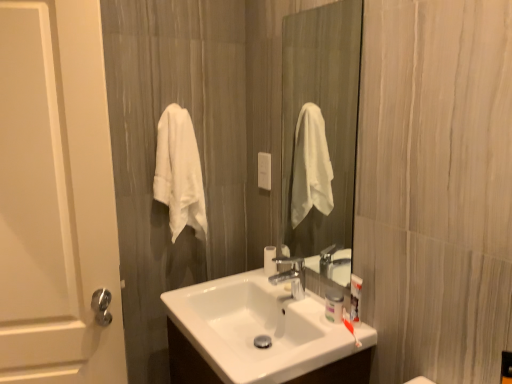
What do you see at coordinates (56, 197) in the screenshot? I see `white matte door at left` at bounding box center [56, 197].

Measure the distance between point (x=35, y=110) and camera.

Point (x=35, y=110) is 1.28 meters from camera.

You are a GUI agent. You are given a task and a screenshot of the screen. Output one action in this format:
    pyautogui.click(x=<x>, y=<y>)
    Task: Click on the white glossy sink at center
    
    Given the screenshot: What is the action you would take?
    pyautogui.click(x=259, y=335)

This screenshot has width=512, height=384. Identify the location of clear glass mirror at center. (320, 122).

Considering the relative sizes of clear glass mirror at center and white matte door at left in the image provided, is clear glass mirror at center taller than white matte door at left?

No.

Is clear glass mirror at center facing towards white matte door at left?

Yes, clear glass mirror at center faces towards white matte door at left.

Considering the relative positions of clear glass mirror at center and white matte door at left in the image provided, is clear glass mirror at center to the left or to the right of white matte door at left?

Based on their positions, clear glass mirror at center is located to the right of white matte door at left.

Is point (372, 330) closer or farther from the camera than point (98, 283)?

Point (372, 330) appears to be closer to the viewer than point (98, 283).

Locate an element on the screen. door located above the white glossy sink at center (from a real-world perspective) is located at coordinates (56, 197).

How many degrees apart are the facing directions of white glossy sink at center and white matte door at left?

The angular difference between white glossy sink at center and white matte door at left is 80.3 degrees.

From a real-world perspective, between white glossy sink at center and clear glass mirror at center, who is vertically higher?

clear glass mirror at center is physically above.

In the scene shown: Which is correct: white glossy sink at center is inside clear glass mirror at center, or outside of it?

The correct answer is: outside.

Does white glossy sink at center turn towards clear glass mirror at center?

No, white glossy sink at center is not turned towards clear glass mirror at center.

Locate an element on the screen. The height and width of the screenshot is (384, 512). mirror behind the white glossy sink at center is located at coordinates (320, 122).

Between white matte door at left and clear glass mirror at center, which one is positioned in front?

white matte door at left is in front.

From a real-world perspective, is white matte door at left physically located above or below clear glass mirror at center?

white matte door at left is below clear glass mirror at center.

Would you say white matte door at left contains clear glass mirror at center?

No.

From the image's perspective, would you say white matte door at left is positioned over clear glass mirror at center?

No.

Relative to white soft towel at left, is clear glass mirror at center in front or behind?

Clearly, clear glass mirror at center is in front of white soft towel at left.

Between point (355, 38) and point (193, 227), which one is positioned in front?

The point (193, 227) is in front.

Considering the relative positions of clear glass mirror at center and white soft towel at left in the image provided, is clear glass mirror at center to the right of white soft towel at left from the viewer's perspective?

Yes, clear glass mirror at center is to the right of white soft towel at left.

Between clear glass mirror at center and white soft towel at left, which one has larger width?

Wider between the two is white soft towel at left.

From a real-world perspective, is white glossy sink at center located beneath white soft towel at left?

Indeed, from a real-world perspective, white glossy sink at center is positioned beneath white soft towel at left.

Is white glossy sink at center in contact with white soft towel at left?

They are not placed beside each other.

Is white glossy sink at center in front of or behind white soft towel at left in the image?

white glossy sink at center is positioned closer to the viewer than white soft towel at left.

Looking at their sizes, would you say white glossy sink at center is wider or thinner than white soft towel at left?

In the image, white glossy sink at center appears to be wider than white soft towel at left.

Looking at this image, who is more distant, white matte door at left or white glossy sink at center?

white matte door at left is further from the camera.

From the image's perspective, which is above, white matte door at left or white glossy sink at center?

white matte door at left is shown above in the image.

How different are the orientations of white matte door at left and white glossy sink at center in degrees?

The angle between the facing direction of white matte door at left and the facing direction of white glossy sink at center is 80.3 degrees.

This screenshot has height=384, width=512. Find the location of `door that appears above the white glossy sink at center (from a real-world perspective)`. door that appears above the white glossy sink at center (from a real-world perspective) is located at coordinates (56, 197).

The image size is (512, 384). What are the coordinates of `door below the clear glass mirror at center (from a real-world perspective)` in the screenshot? It's located at (56, 197).

This screenshot has height=384, width=512. What are the coordinates of `sink below the white matte door at left (from the image's perspective)` in the screenshot? It's located at (259, 335).

Based on their spatial positions, is white soft towel at left or clear glass mirror at center closer to white glossy sink at center?

Based on the image, white soft towel at left appears to be nearer to white glossy sink at center.

Based on their spatial positions, is white glossy sink at center or white soft towel at left closer to clear glass mirror at center?

Among the two, white soft towel at left is located nearer to clear glass mirror at center.

In the scene shown: Looking at the image, which one is located further to clear glass mirror at center, white matte door at left or white glossy sink at center?

The object further to clear glass mirror at center is white matte door at left.

Based on their spatial positions, is white glossy sink at center or clear glass mirror at center closer to white soft towel at left?

white glossy sink at center is closer to white soft towel at left.

Which object lies further to the anchor point clear glass mirror at center, white soft towel at left or white matte door at left?

The object further to clear glass mirror at center is white matte door at left.

Estimate the real-world distances between objects in this image. Which object is closer to white glossy sink at center, clear glass mirror at center or white matte door at left?

white matte door at left lies closer to white glossy sink at center than the other object.

Which object lies nearer to the anchor point white matte door at left, white soft towel at left or white glossy sink at center?

white soft towel at left lies closer to white matte door at left than the other object.

Estimate the real-world distances between objects in this image. Which object is further from clear glass mirror at center, white matte door at left or white soft towel at left?

Among the two, white matte door at left is located further to clear glass mirror at center.

You are a GUI agent. You are given a task and a screenshot of the screen. Output one action in this format:
    pyautogui.click(x=<x>, y=<y>)
    Task: Click on the bath towel situated between white matte door at left and white glossy sink at center from left to right
    This screenshot has height=384, width=512.
    Given the screenshot: What is the action you would take?
    pyautogui.click(x=179, y=173)

Find the location of a particular element. The height and width of the screenshot is (384, 512). bath towel between clear glass mirror at center and white glossy sink at center from top to bottom is located at coordinates (179, 173).

Locate an element on the screen. This screenshot has height=384, width=512. sink between white matte door at left and clear glass mirror at center is located at coordinates pos(259,335).

This screenshot has width=512, height=384. What are the coordinates of `bath towel between white matte door at left and clear glass mirror at center from left to right` in the screenshot? It's located at (179, 173).